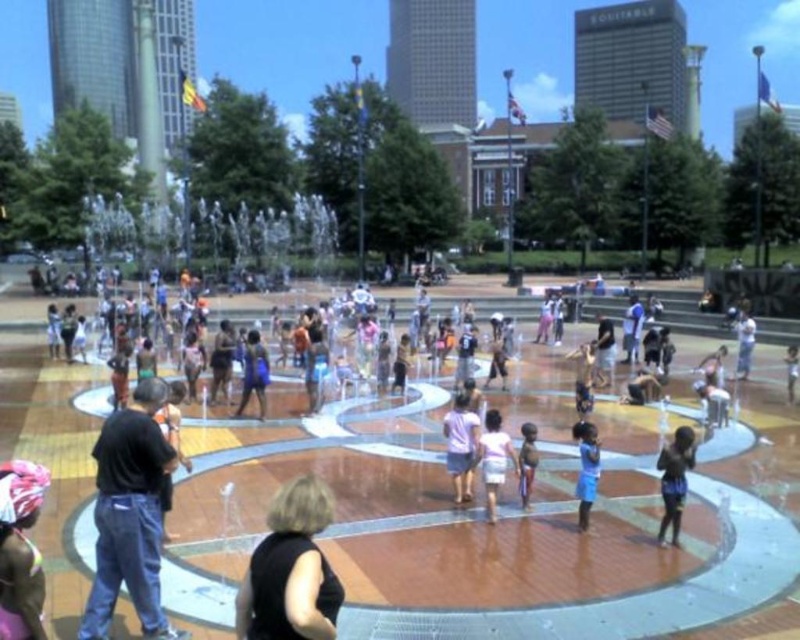
Question: Considering the relative positions of blue denim shorts at lower right and light brown wooden stick at center in the image provided, where is blue denim shorts at lower right located with respect to light brown wooden stick at center?

Choices:
 (A) below
 (B) above

Answer: (A)

Question: Among these points, which one is nearest to the camera?

Choices:
 (A) click(x=472, y=451)
 (B) click(x=102, y=630)
 (C) click(x=296, y=499)

Answer: (C)

Question: Which point is farther to the camera?

Choices:
 (A) (746, 321)
 (B) (674, 477)

Answer: (A)

Question: Is black cotton shirt at lower left to the left of light blue denim shorts at center from the viewer's perspective?

Choices:
 (A) no
 (B) yes

Answer: (B)

Question: Considering the real-world distances, which object is farthest from the light brown wooden stick at center?

Choices:
 (A) light purple fabric shirt at center
 (B) blue fabric at center

Answer: (A)

Question: Observing the image, what is the correct spatial positioning of light purple fabric shirt at center in reference to blue fabric shirt at center?

Choices:
 (A) above
 (B) below

Answer: (B)